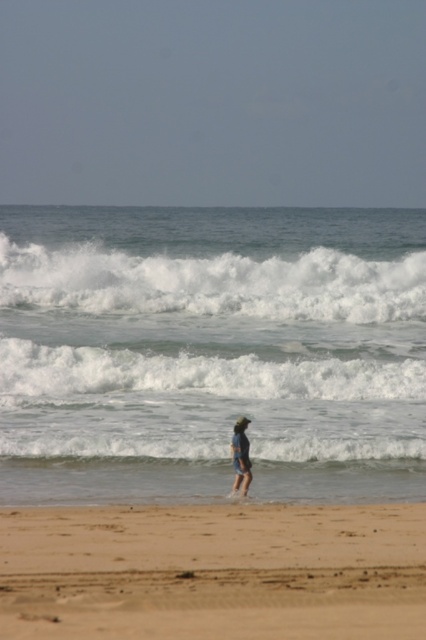
Question: Estimate the real-world distances between objects in this image. Which object is closer to the white foamy wave at center?

Choices:
 (A) white foamy water at center
 (B) white foamy wave at upper center
 (C) blue denim shorts at center

Answer: (C)

Question: Which point is closer to the camera?

Choices:
 (A) (325, 273)
 (B) (58, 296)
 (C) (296, 396)

Answer: (C)

Question: Among these points, which one is nearest to the camera?

Choices:
 (A) (255, 300)
 (B) (333, 356)

Answer: (B)

Question: Can you confirm if white foamy wave at center is positioned above blue denim shorts at center?

Choices:
 (A) yes
 (B) no

Answer: (A)

Question: In this image, where is sandy beach at lower center located relative to blue denim shorts at center?

Choices:
 (A) below
 (B) above

Answer: (A)

Question: Can you confirm if white foamy wave at upper center is positioned below white foamy wave at center?

Choices:
 (A) yes
 (B) no

Answer: (B)